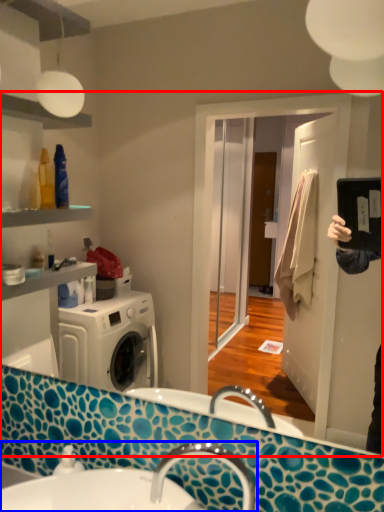
Question: Among these objects, which one is nearest to the camera, mirror (highlighted by a red box) or sink (highlighted by a blue box)?

Choices:
 (A) mirror
 (B) sink

Answer: (A)